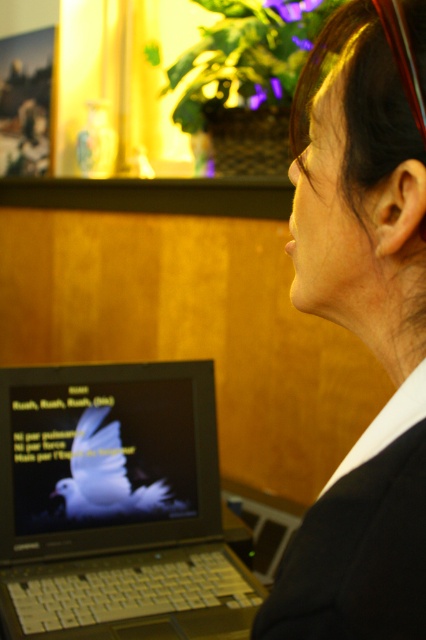
Question: Can you confirm if matte black laptop at center is positioned to the right of black fabric business suit at lower right?

Choices:
 (A) no
 (B) yes

Answer: (A)

Question: Is black fabric at center positioned in front of black fabric business suit at lower right?

Choices:
 (A) no
 (B) yes

Answer: (A)

Question: Which point is farther from the camera taking this photo?

Choices:
 (A) (74, 448)
 (B) (382, 541)
 (C) (11, 432)
 (D) (321, 163)

Answer: (A)

Question: Is black fabric at center behind black fabric business suit at lower right?

Choices:
 (A) yes
 (B) no

Answer: (A)

Question: Which point is farther to the camera?

Choices:
 (A) matte black laptop at center
 (B) black fabric at center
 (C) black fabric business suit at lower right
 (D) white matte bird at center

Answer: (D)

Question: Which of the following is the farthest from the observer?

Choices:
 (A) black fabric business suit at lower right
 (B) matte black laptop at center
 (C) black fabric at center
 (D) white matte bird at center

Answer: (D)